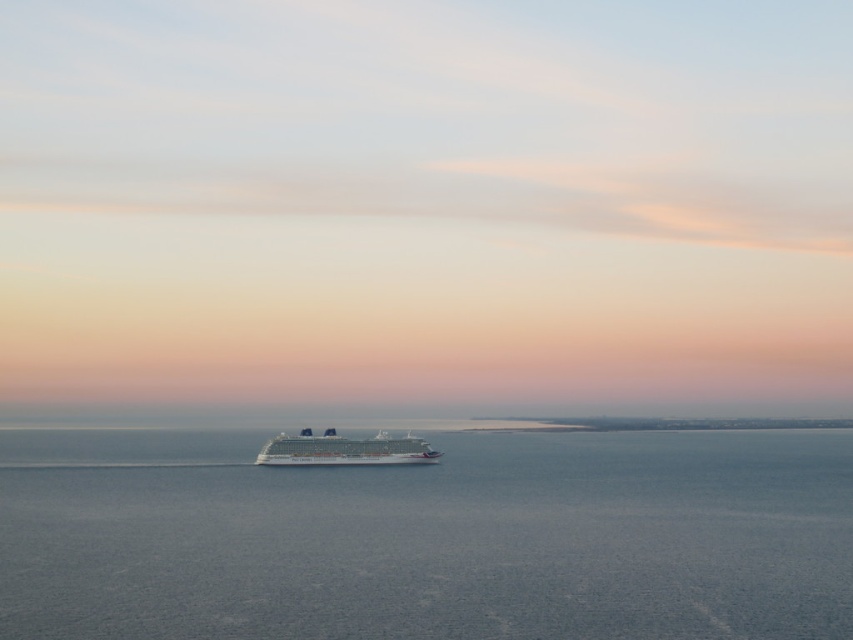
Who is more forward, (585, 538) or (276, 436)?

Point (585, 538) is more forward.

Is point (381, 568) closer to camera compared to point (335, 440)?

That is True.

This screenshot has height=640, width=853. What do you see at coordinates (428, 538) in the screenshot? I see `blue water at center` at bounding box center [428, 538].

Locate an element on the screen. blue water at center is located at coordinates (428, 538).